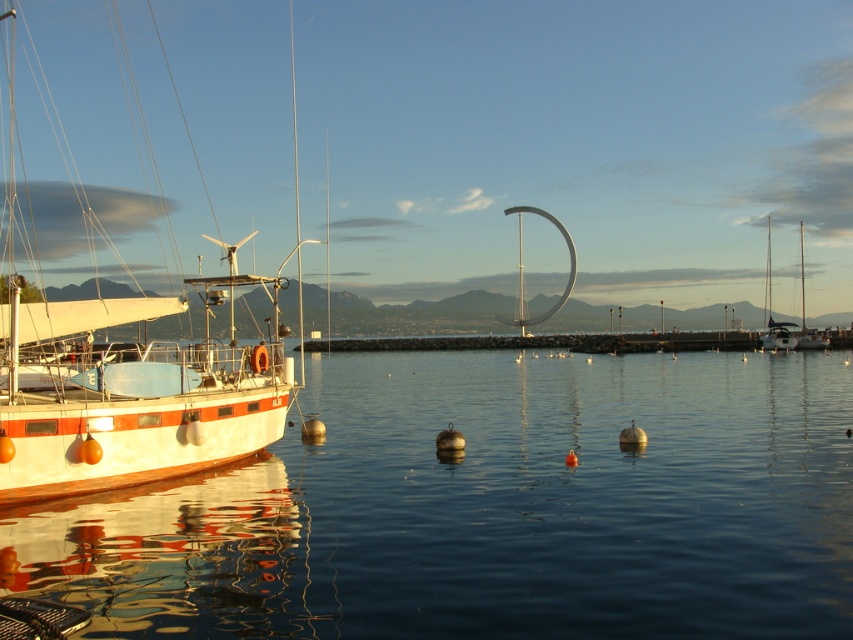
You are a sailor who needs to navigate through the transparent water at center and the white matte sailboat at right. Which object is located lower in the scene?

The transparent water at center is located below the white matte sailboat at right, so it is lower in the scene.

You are a sailor who wants to move your boat from the left to the right side of the marina. The marina has a rule that you must stay between the buoys. Given that the white matte boat at left is to the left of the white matte sailboat at right, which boat should you avoid moving past to stay within the designated area?

You should avoid moving past the white matte sailboat at right because the white matte boat at left is positioned to the left of it, indicating the designated area ends at the white matte sailboat at right.